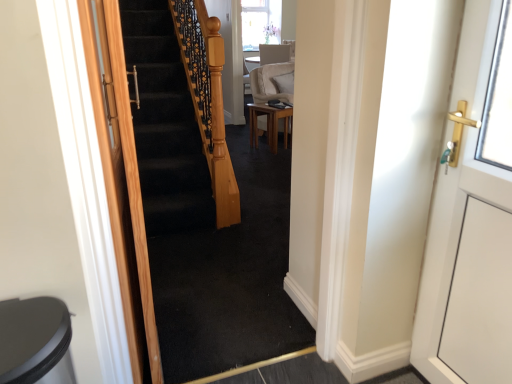
Question: From the image's perspective, would you say white glossy door at right, arranged as the first door when viewed from the right, is positioned over wooden door at left, placed as the first door when sorted from left to right?

Choices:
 (A) yes
 (B) no

Answer: (A)

Question: Is wooden door at left, placed as the first door when sorted from left to right, located within white glossy door at right, the 2th door from the left?

Choices:
 (A) yes
 (B) no

Answer: (B)

Question: Is white glossy door at right, the 2th door from the left, far away from wooden door at left, the second door in the right-to-left sequence?

Choices:
 (A) yes
 (B) no

Answer: (A)

Question: Can you confirm if white glossy door at right, the 2th door from the left, is taller than wooden door at left, the second door in the right-to-left sequence?

Choices:
 (A) no
 (B) yes

Answer: (A)

Question: Does white glossy door at right, arranged as the first door when viewed from the right, come in front of wooden door at left, the second door in the right-to-left sequence?

Choices:
 (A) yes
 (B) no

Answer: (A)

Question: Considering their positions, is suede beige armchair at center located in front of or behind wooden door at left, placed as the first door when sorted from left to right?

Choices:
 (A) behind
 (B) front

Answer: (A)

Question: In the image, is suede beige armchair at center on the left side or the right side of wooden door at left, the second door in the right-to-left sequence?

Choices:
 (A) left
 (B) right

Answer: (B)

Question: Considering the positions of point (280, 84) and point (98, 114), is point (280, 84) closer or farther from the camera than point (98, 114)?

Choices:
 (A) farther
 (B) closer

Answer: (A)

Question: Is suede beige armchair at center inside the boundaries of wooden door at left, placed as the first door when sorted from left to right, or outside?

Choices:
 (A) outside
 (B) inside

Answer: (A)

Question: In the image, is light brown wooden table at center on the left side or the right side of suede beige armchair at center?

Choices:
 (A) right
 (B) left

Answer: (B)

Question: From the image's perspective, is light brown wooden table at center above or below suede beige armchair at center?

Choices:
 (A) below
 (B) above

Answer: (A)

Question: From a real-world perspective, is light brown wooden table at center positioned above or below suede beige armchair at center?

Choices:
 (A) above
 (B) below

Answer: (B)

Question: Does point (288, 107) appear closer or farther from the camera than point (282, 82)?

Choices:
 (A) farther
 (B) closer

Answer: (B)

Question: Is wooden door at left, the second door in the right-to-left sequence, inside the boundaries of light brown wooden table at center, or outside?

Choices:
 (A) inside
 (B) outside

Answer: (B)

Question: From a real-world perspective, relative to light brown wooden table at center, is wooden door at left, the second door in the right-to-left sequence, vertically above or below?

Choices:
 (A) above
 (B) below

Answer: (A)